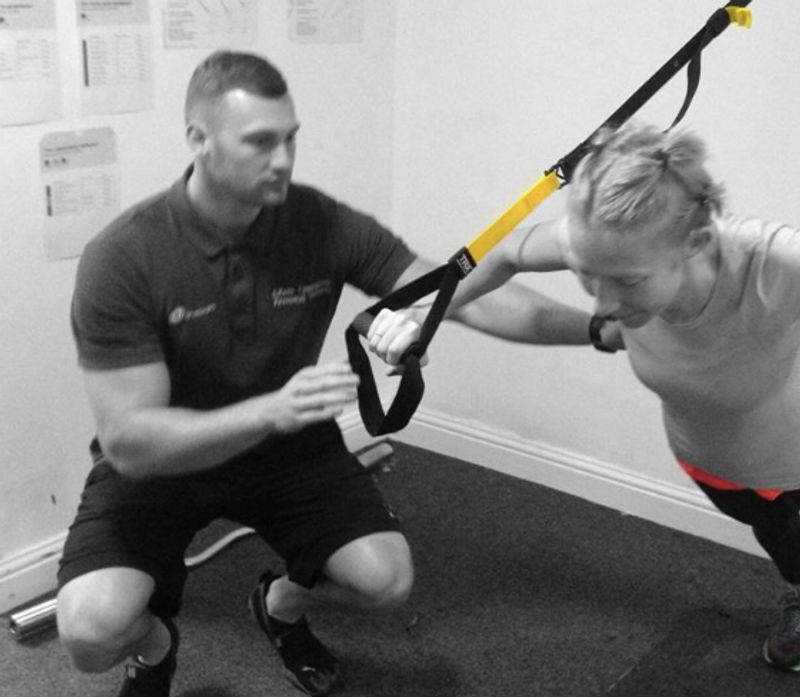
This screenshot has width=800, height=697. What are the coordinates of `carpet` in the screenshot? It's located at (585, 595).